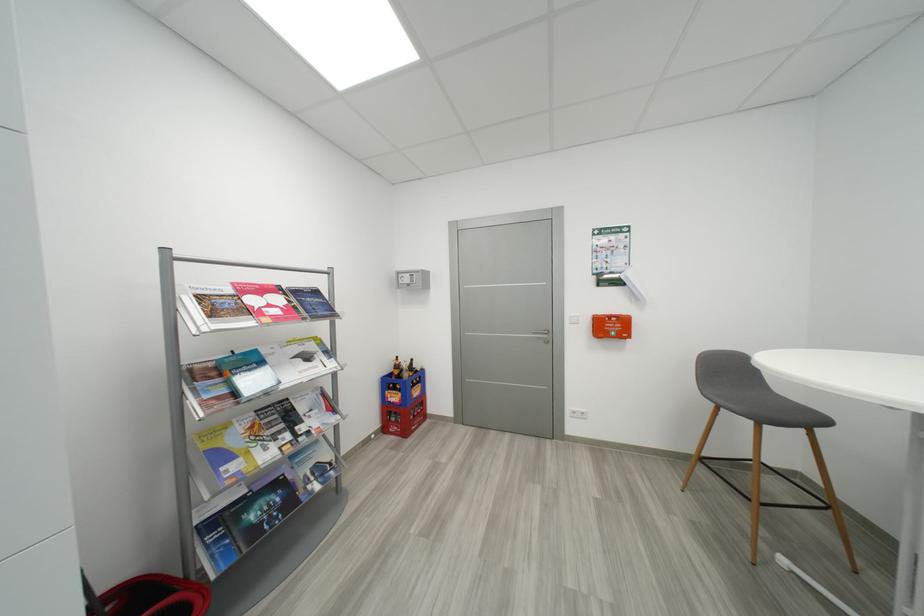
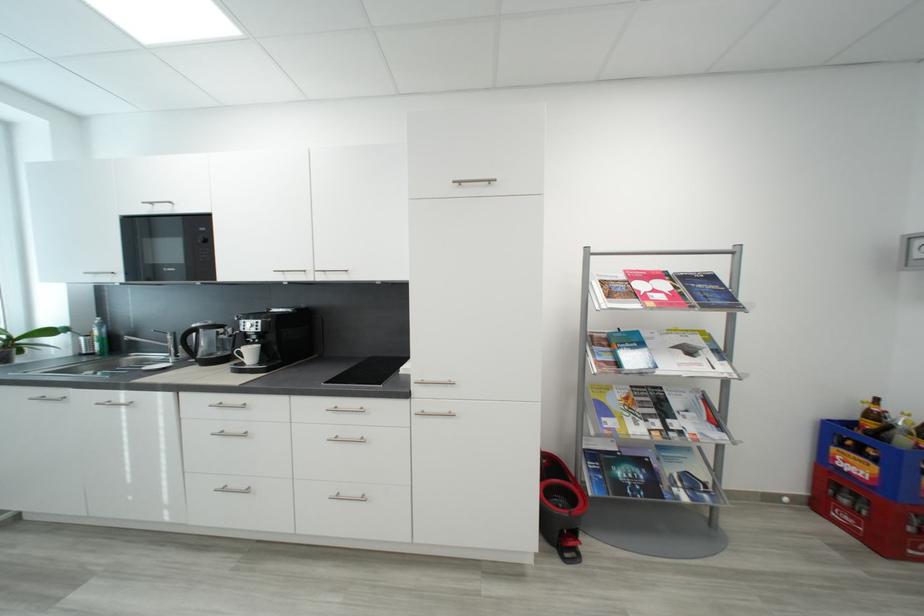
The point at (x=285, y=485) is marked in the first image. Where is the corresponding point in the second image?

(650, 464)